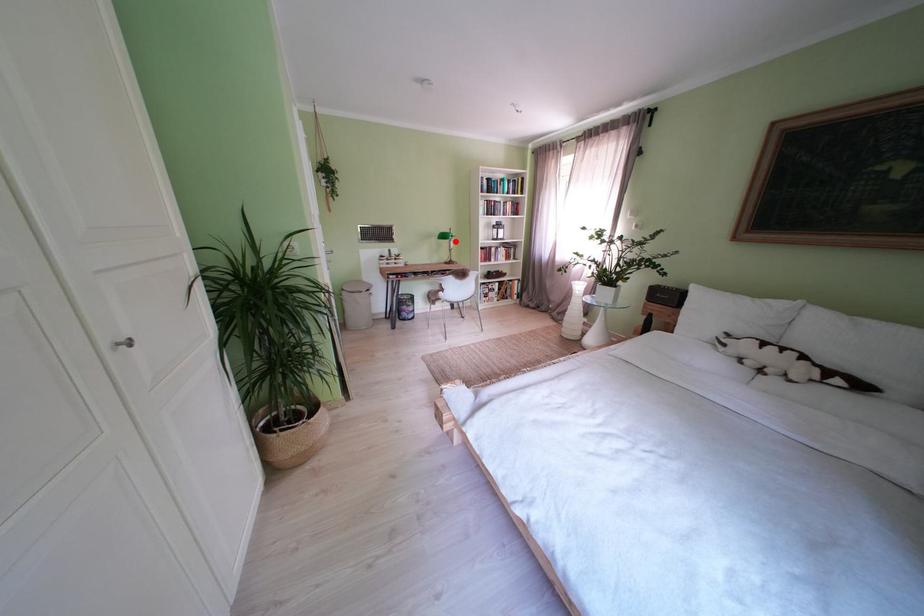
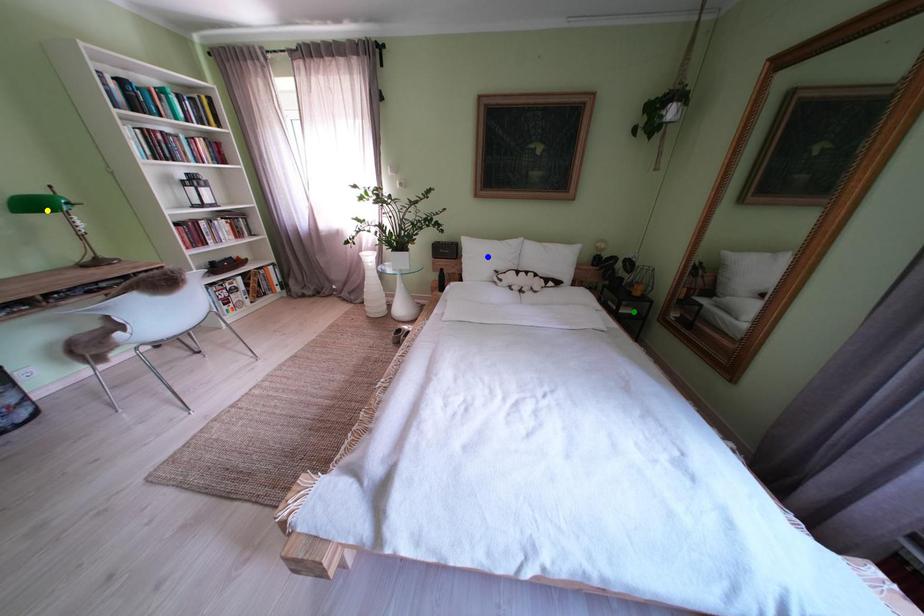
Question: I am providing you with two images of the same scene from different viewpoints. A red point is marked on the first image. You are given multiple points on the second image. Which spot in image 2 lines up with the point in image 1?

Choices:
 (A) green point
 (B) blue point
 (C) yellow point

Answer: (C)